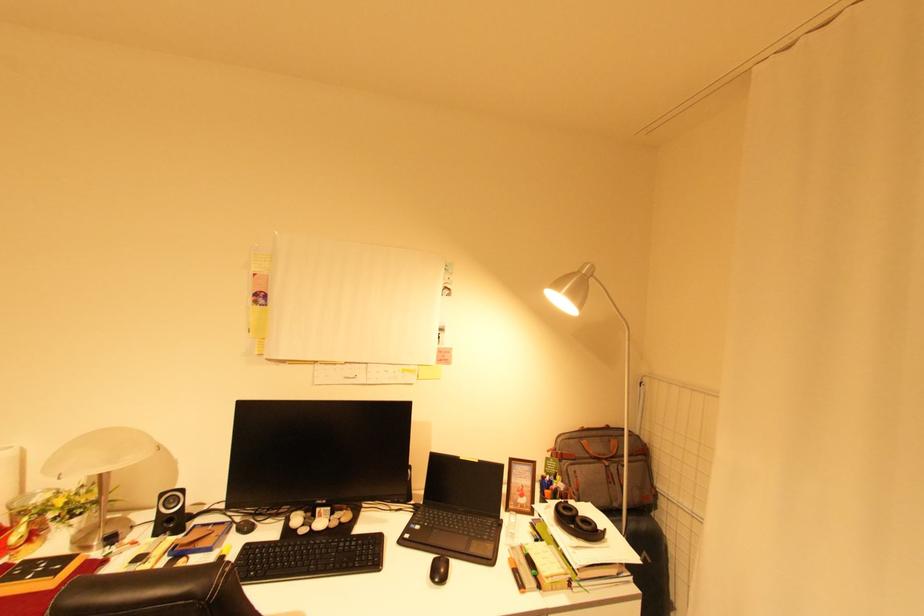
Image resolution: width=924 pixels, height=616 pixels. Identify the location of black pen. (516, 575).